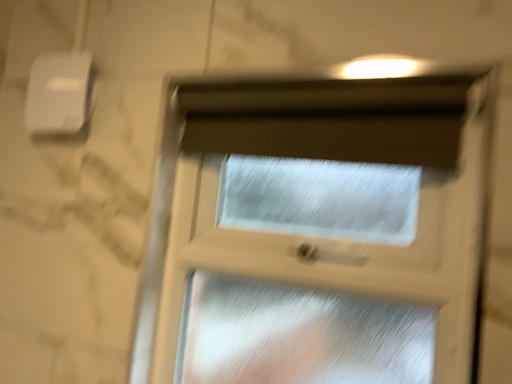
What is the approximate width of matte beige window at center?

It is 6.40 inches.

What do you see at coordinates (315, 231) in the screenshot?
I see `matte beige window at center` at bounding box center [315, 231].

Where is `matte beige window at center`? This screenshot has width=512, height=384. matte beige window at center is located at coordinates (315, 231).

The image size is (512, 384). I want to click on matte beige window at center, so click(315, 231).